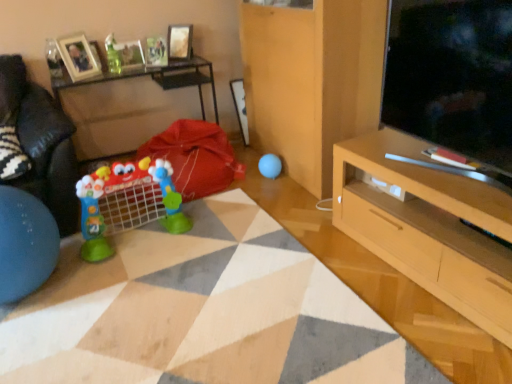
Question: Considering the relative positions of light wood cabinet at lower right and wooden photo frame at upper left, the first picture frame positioned from the left, in the image provided, is light wood cabinet at lower right to the right of wooden photo frame at upper left, the first picture frame positioned from the left, from the viewer's perspective?

Choices:
 (A) no
 (B) yes

Answer: (B)

Question: Considering the relative sizes of light wood cabinet at lower right and wooden photo frame at upper left, arranged as the third picture frame when viewed from the right, in the image provided, is light wood cabinet at lower right wider than wooden photo frame at upper left, arranged as the third picture frame when viewed from the right,?

Choices:
 (A) no
 (B) yes

Answer: (B)

Question: Does light wood cabinet at lower right come in front of wooden photo frame at upper left, the first picture frame positioned from the left?

Choices:
 (A) yes
 (B) no

Answer: (A)

Question: Is light wood cabinet at lower right not inside wooden photo frame at upper left, the first picture frame positioned from the left?

Choices:
 (A) no
 (B) yes

Answer: (B)

Question: Can you confirm if light wood cabinet at lower right is shorter than wooden photo frame at upper left, arranged as the third picture frame when viewed from the right?

Choices:
 (A) yes
 (B) no

Answer: (B)

Question: From the image's perspective, is light wood cabinet at lower right under wooden photo frame at upper left, arranged as the third picture frame when viewed from the right?

Choices:
 (A) no
 (B) yes

Answer: (B)

Question: Is metallic silver picture frame at upper center, marked as the 3th picture frame in a left-to-right arrangement, closer to the viewer compared to wooden table at left?

Choices:
 (A) yes
 (B) no

Answer: (B)

Question: Can you confirm if metallic silver picture frame at upper center, marked as the 3th picture frame in a left-to-right arrangement, is bigger than wooden table at left?

Choices:
 (A) no
 (B) yes

Answer: (A)

Question: Can you confirm if metallic silver picture frame at upper center, which appears as the 1th picture frame when viewed from the right, is positioned to the left of wooden table at left?

Choices:
 (A) no
 (B) yes

Answer: (A)

Question: From the image's perspective, is metallic silver picture frame at upper center, marked as the 3th picture frame in a left-to-right arrangement, under wooden table at left?

Choices:
 (A) yes
 (B) no

Answer: (B)

Question: Does metallic silver picture frame at upper center, marked as the 3th picture frame in a left-to-right arrangement, have a greater width compared to wooden table at left?

Choices:
 (A) no
 (B) yes

Answer: (A)

Question: Is metallic silver picture frame at upper center, marked as the 3th picture frame in a left-to-right arrangement, not close to wooden table at left?

Choices:
 (A) no
 (B) yes

Answer: (A)

Question: Is matte glass picture frame at upper left, the second picture frame in the right-to-left sequence, located outside metallic silver picture frame at upper center, marked as the 3th picture frame in a left-to-right arrangement?

Choices:
 (A) no
 (B) yes

Answer: (B)